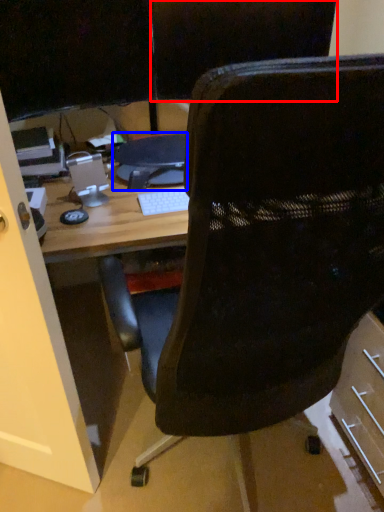
Question: Which point is closer to the camera, back (highlighted by a red box) or computer (highlighted by a blue box)?

Choices:
 (A) back
 (B) computer

Answer: (A)